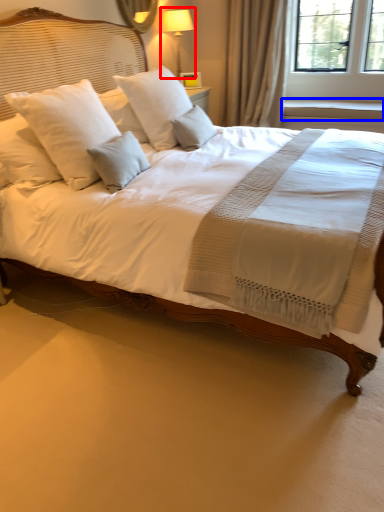
Question: Which object appears farthest to the camera in this image, bedside lamp (highlighted by a red box) or window sill (highlighted by a blue box)?

Choices:
 (A) bedside lamp
 (B) window sill

Answer: (B)